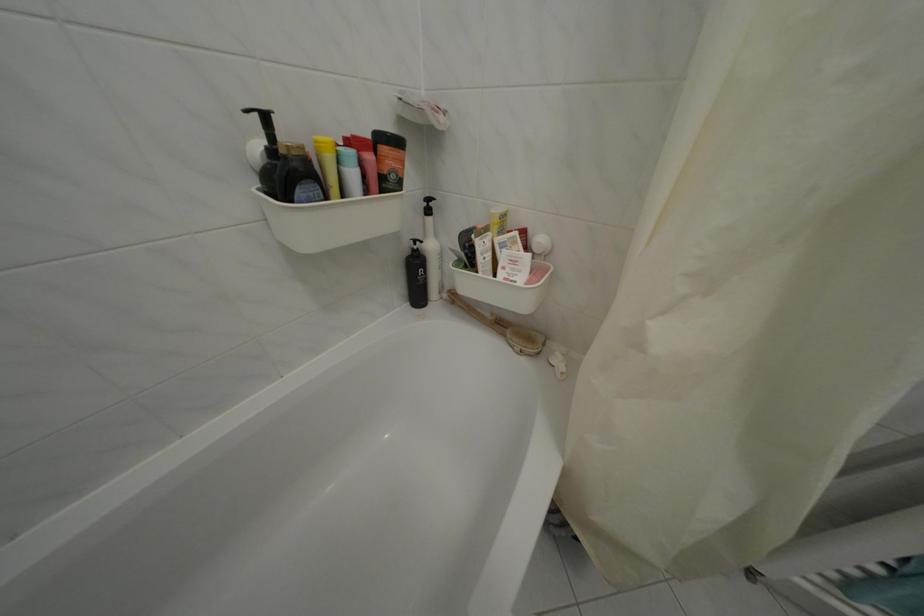
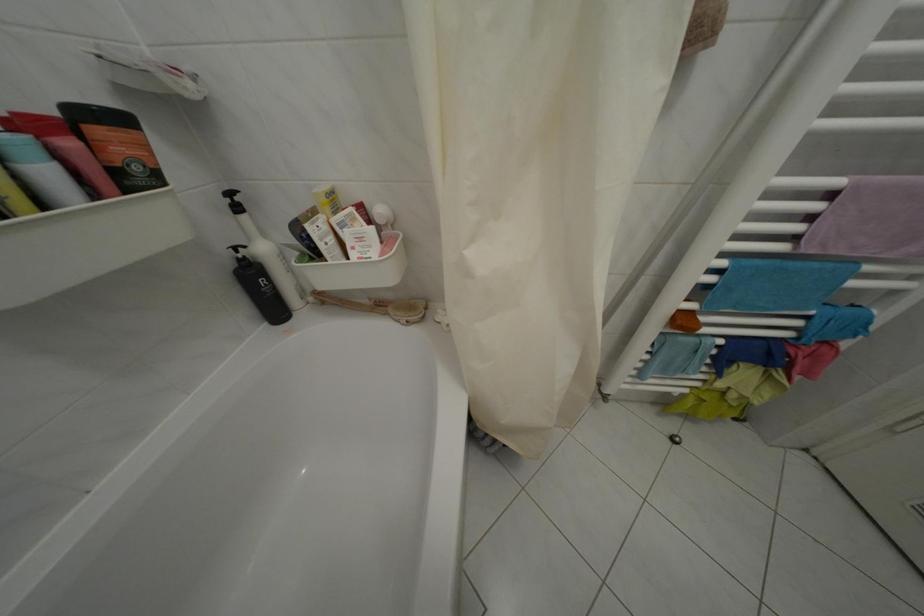
The point at [431,248] is marked in the first image. Where is the corresponding point in the second image?

(253, 254)